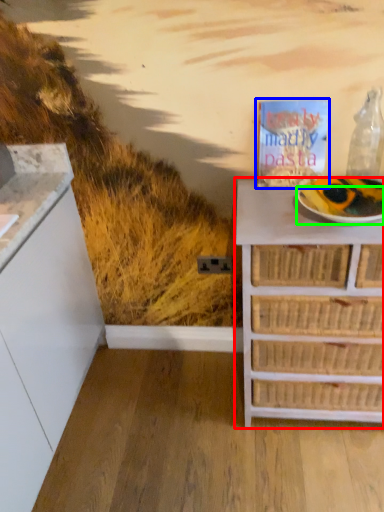
Question: Which is farther away from chest of drawers (highlighted by a red box)? magazine (highlighted by a blue box) or paper plate (highlighted by a green box)?

Choices:
 (A) magazine
 (B) paper plate

Answer: (A)